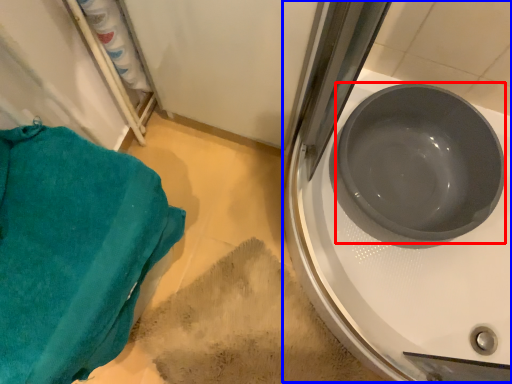
Question: Which object is further to the camera taking this photo, basin (highlighted by a red box) or sink (highlighted by a blue box)?

Choices:
 (A) basin
 (B) sink

Answer: (A)